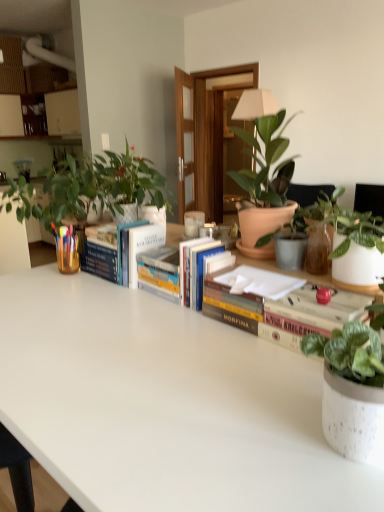
What are the coordinates of `vacant space underneath white matte paper at center, which appears as the 1th paperback book when viewed from the right (from a real-world perspective)` in the screenshot? It's located at (259, 286).